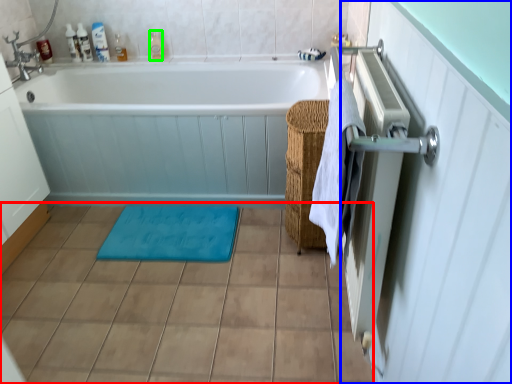
Question: Which object is positioned farthest from ceramic tile (highlighted by a red box)? Select from screen door (highlighted by a blue box) and toiletry (highlighted by a green box).

Choices:
 (A) screen door
 (B) toiletry

Answer: (B)